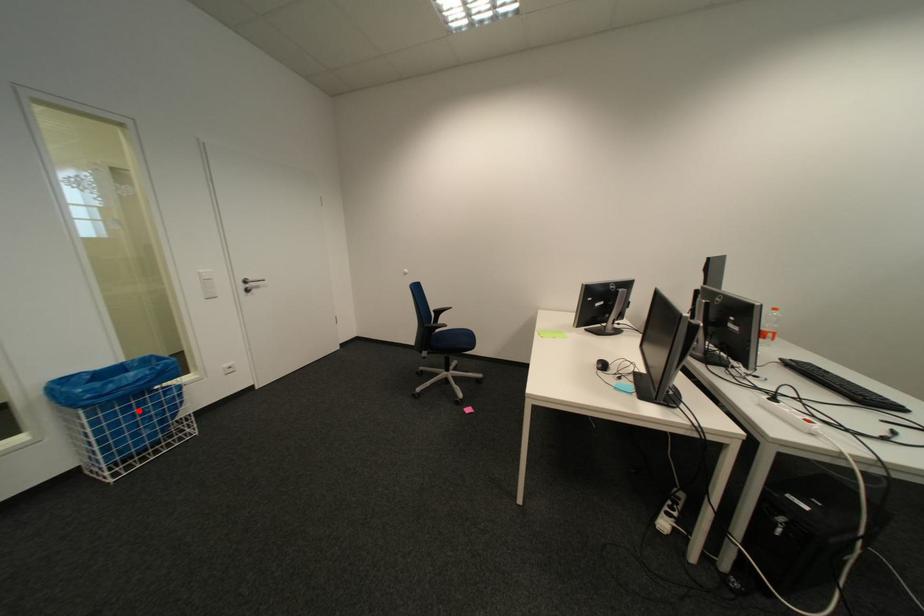
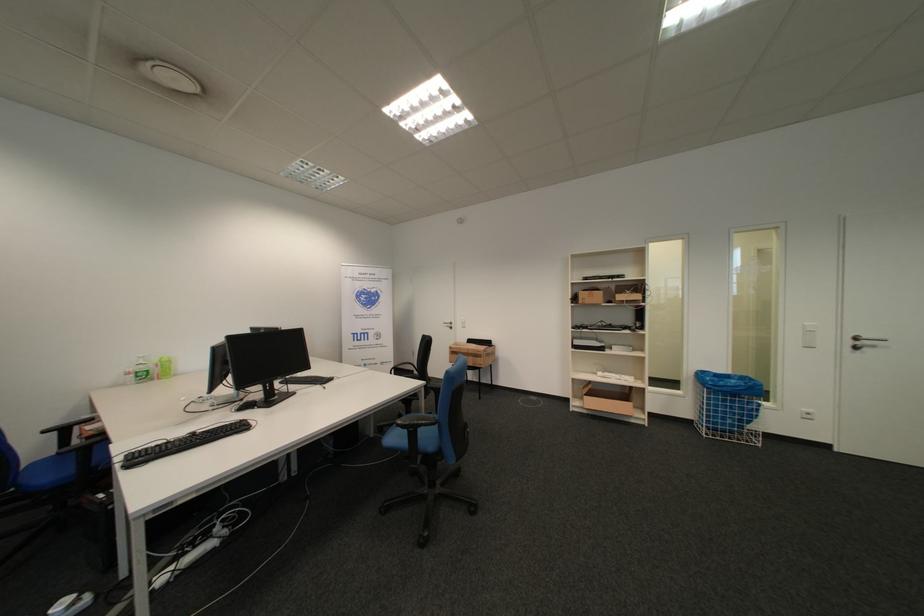
Locate, in the second image, the point that corresponds to the highlighted location in the first image.

(736, 402)